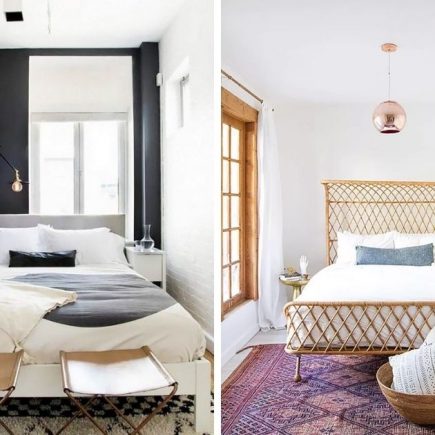
The height and width of the screenshot is (435, 435). Identify the location of wicker basket. (403, 402).